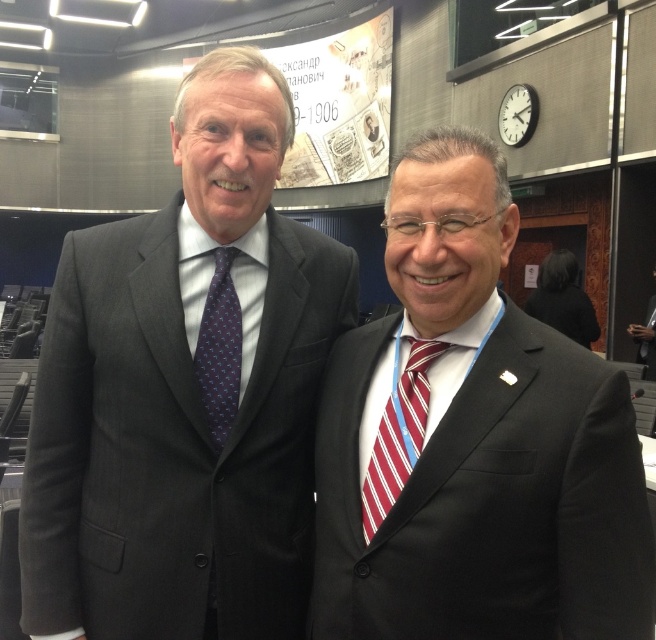
Identify the location of red striped tie at right. (x=382, y=472).

Between red striped tie at right and dark blue silk tie at center, which one is positioned higher?

dark blue silk tie at center is above.

Between point (386, 464) and point (209, 397), which one is positioned behind?

Positioned behind is point (209, 397).

Where is `red striped tie at right`? Image resolution: width=656 pixels, height=640 pixels. red striped tie at right is located at coordinates (382, 472).

What do you see at coordinates (472, 440) in the screenshot? This screenshot has width=656, height=640. I see `matte black suit at right` at bounding box center [472, 440].

Does matte black suit at right have a smaller size compared to dark blue silk tie at center?

Actually, matte black suit at right might be larger than dark blue silk tie at center.

Between point (611, 451) and point (201, 384), which one is positioned behind?

The point (201, 384) is behind.

Identify the location of matte black suit at right. (472, 440).

Does dark gray suit at left lie behind red striped tie at right?

Yes, it is.

Does dark gray suit at left appear under red striped tie at right?

Incorrect, dark gray suit at left is not positioned below red striped tie at right.

This screenshot has width=656, height=640. What are the coordinates of `dark gray suit at left` in the screenshot? It's located at (186, 392).

Find the location of a particular element. The image size is (656, 640). dark gray suit at left is located at coordinates [186, 392].